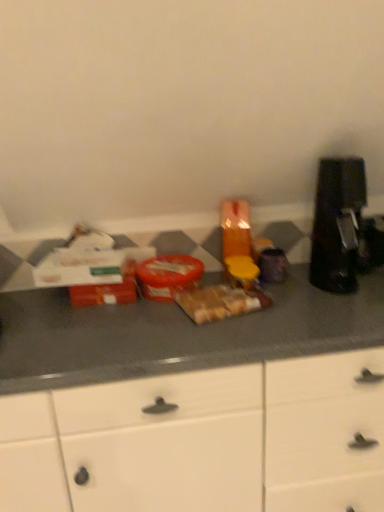
The width and height of the screenshot is (384, 512). What are the coordinates of `free space above white matte cabinet at center (from a real-world perspective)` in the screenshot? It's located at (158, 316).